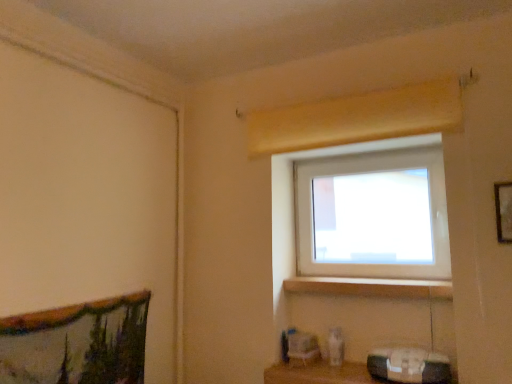
Identify the location of wooden shelf at lower center. The image size is (512, 384). (321, 374).

This screenshot has width=512, height=384. What do you see at coordinates (370, 287) in the screenshot? I see `wooden at lower center` at bounding box center [370, 287].

This screenshot has width=512, height=384. Identify the location of wooden at lower center. (370, 287).

Measure the distance between wooden picture frame at upper right and camera.

wooden picture frame at upper right and camera are 5.40 feet apart from each other.

Image resolution: width=512 pixels, height=384 pixels. I want to click on wooden shelf at lower center, so click(x=321, y=374).

Between wooden at lower center and white plastic window at upper center, which one has smaller size?

Smaller between the two is wooden at lower center.

Can you confirm if wooden at lower center is thinner than white plastic window at upper center?

In fact, wooden at lower center might be wider than white plastic window at upper center.

How many degrees apart are the facing directions of wooden at lower center and white plastic window at upper center?

The angle between the facing direction of wooden at lower center and the facing direction of white plastic window at upper center is 1.53 degrees.

How much distance is there between wooden at lower center and white plastic window at upper center?

wooden at lower center and white plastic window at upper center are 13.25 inches apart from each other.

Would you say wooden shelf at lower center is a long distance from wooden at lower center?

No.

Considering the points (307, 370) and (443, 282), which point is behind, point (307, 370) or point (443, 282)?

The point (307, 370) is farther from the camera.

From the image's perspective, between wooden shelf at lower center and wooden at lower center, who is located below?

wooden shelf at lower center appears lower in the image.

Based on the photo, can you confirm if wooden shelf at lower center is bigger than wooden at lower center?

Indeed, wooden shelf at lower center has a larger size compared to wooden at lower center.

Where is `picture frame in front of the wooden at lower center`? The width and height of the screenshot is (512, 384). picture frame in front of the wooden at lower center is located at coordinates (503, 211).

Which object is positioned more to the right, wooden picture frame at upper right or wooden at lower center?

wooden picture frame at upper right.

From a real-world perspective, is wooden picture frame at upper right over wooden at lower center?

Yes, from a real-world perspective, wooden picture frame at upper right is above wooden at lower center.

Could wooden at lower center be considered to be inside wooden picture frame at upper right?

Actually, wooden at lower center is outside wooden picture frame at upper right.

Is white plastic window at upper center in front of or behind wooden at lower center in the image?

Visually, white plastic window at upper center is located behind wooden at lower center.

Looking at their sizes, would you say white plastic window at upper center is wider or thinner than wooden at lower center?

Clearly, white plastic window at upper center has less width compared to wooden at lower center.

Is wooden at lower center at the back of white plastic window at upper center?

No.

Is point (327, 383) more distant than point (509, 190)?

Yes.

Looking at this image, which object is further away from the camera taking this photo, wooden shelf at lower center or wooden picture frame at upper right?

wooden shelf at lower center is behind.

Is wooden shelf at lower center positioned with its back to wooden picture frame at upper right?

No, wooden picture frame at upper right is not at the back of wooden shelf at lower center.

Is white plastic window at upper center oriented towards wooden picture frame at upper right?

No.

Which is more to the right, white plastic window at upper center or wooden picture frame at upper right?

Positioned to the right is wooden picture frame at upper right.

Where is `picture frame on the right side of white plastic window at upper center`? This screenshot has height=384, width=512. picture frame on the right side of white plastic window at upper center is located at coordinates (503, 211).

Who is taller, white plastic window at upper center or wooden picture frame at upper right?

white plastic window at upper center is taller.

Based on the photo, can you tell me how much wooden shelf at lower center and white plastic window at upper center differ in facing direction?

wooden shelf at lower center and white plastic window at upper center are facing 0.647 degrees away from each other.

Looking at this image, considering the relative sizes of wooden shelf at lower center and white plastic window at upper center in the image provided, is wooden shelf at lower center thinner than white plastic window at upper center?

No, wooden shelf at lower center is not thinner than white plastic window at upper center.

Choose the correct answer: Is wooden shelf at lower center inside white plastic window at upper center or outside it?

wooden shelf at lower center is spatially situated outside white plastic window at upper center.

In the image, there is a white plastic window at upper center. Identify the location of shelf below it (from the image's perspective). This screenshot has height=384, width=512. (321, 374).

Find the location of `window above the wooden at lower center (from a real-world perspective)`. window above the wooden at lower center (from a real-world perspective) is located at coordinates (x=362, y=212).

The width and height of the screenshot is (512, 384). I want to click on shelf on the left of the wooden at lower center, so click(321, 374).

From the image, which object appears to be nearer to wooden at lower center, wooden picture frame at upper right or wooden shelf at lower center?

wooden shelf at lower center is closer to wooden at lower center.

Looking at the image, which one is located further to white plastic window at upper center, wooden shelf at lower center or wooden picture frame at upper right?

wooden shelf at lower center is positioned further to the anchor white plastic window at upper center.

Looking at the image, which one is located closer to wooden at lower center, wooden shelf at lower center or wooden picture frame at upper right?

wooden shelf at lower center.

From the image, which object appears to be farther from wooden at lower center, white plastic window at upper center or wooden picture frame at upper right?

wooden picture frame at upper right is positioned further to the anchor wooden at lower center.

Looking at the image, which one is located further to wooden shelf at lower center, wooden at lower center or wooden picture frame at upper right?

wooden picture frame at upper right lies further to wooden shelf at lower center than the other object.

Looking at the image, which one is located closer to wooden at lower center, wooden shelf at lower center or white plastic window at upper center?

white plastic window at upper center.

Based on their spatial positions, is wooden at lower center or wooden shelf at lower center closer to white plastic window at upper center?

The object closer to white plastic window at upper center is wooden at lower center.

Based on their spatial positions, is wooden at lower center or white plastic window at upper center closer to wooden picture frame at upper right?

wooden at lower center is positioned closer to the anchor wooden picture frame at upper right.

Find the location of a particular element. The image size is (512, 384). window that lies between wooden picture frame at upper right and wooden shelf at lower center from top to bottom is located at coordinates (362, 212).

Identify the location of window sill between white plastic window at upper center and wooden shelf at lower center in the vertical direction. (370, 287).

Where is `window between wooden at lower center and wooden picture frame at upper right from left to right`? window between wooden at lower center and wooden picture frame at upper right from left to right is located at coordinates (362, 212).

Locate an element on the screen. This screenshot has height=384, width=512. window sill between wooden picture frame at upper right and wooden shelf at lower center from top to bottom is located at coordinates (370, 287).